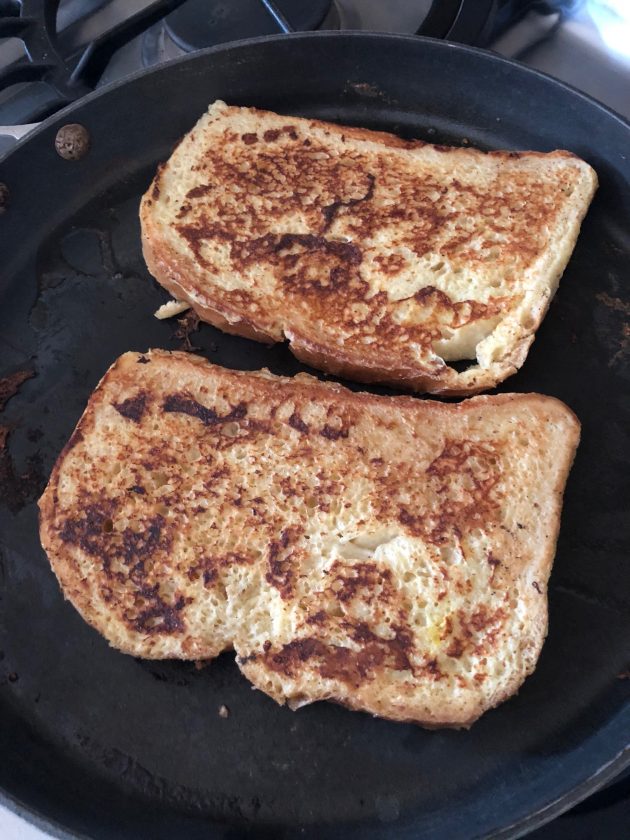
The image size is (630, 840). Identify the location of inside rim of frying pan. (33, 186).